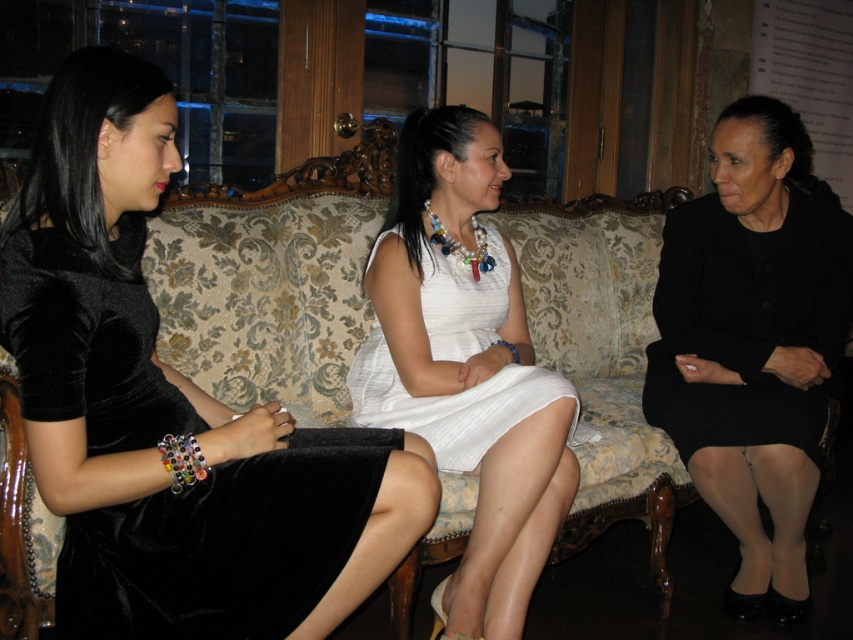
Is point (207, 250) closer to camera compared to point (279, 593)?

No, it is not.

Identify the location of floral-patterned fabric couch at center. This screenshot has width=853, height=640. (265, 296).

Locate an element on the screen. This screenshot has width=853, height=640. floral-patterned fabric couch at center is located at coordinates (265, 296).

Between black matte dress at right and white cotton dress at center, which one appears on the right side from the viewer's perspective?

black matte dress at right

Is black matte dress at right in front of white cotton dress at center?

No, it is not.

This screenshot has width=853, height=640. I want to click on black matte dress at right, so click(x=753, y=342).

Is velvet black dress at left shorter than white satin dress at center?

Yes, velvet black dress at left is shorter than white satin dress at center.

Is velvet black dress at left thinner than white satin dress at center?

Incorrect, velvet black dress at left's width is not less than white satin dress at center's.

Locate an element on the screen. velvet black dress at left is located at coordinates pos(224,545).

Where is `velvet black dress at left`? velvet black dress at left is located at coordinates (224, 545).